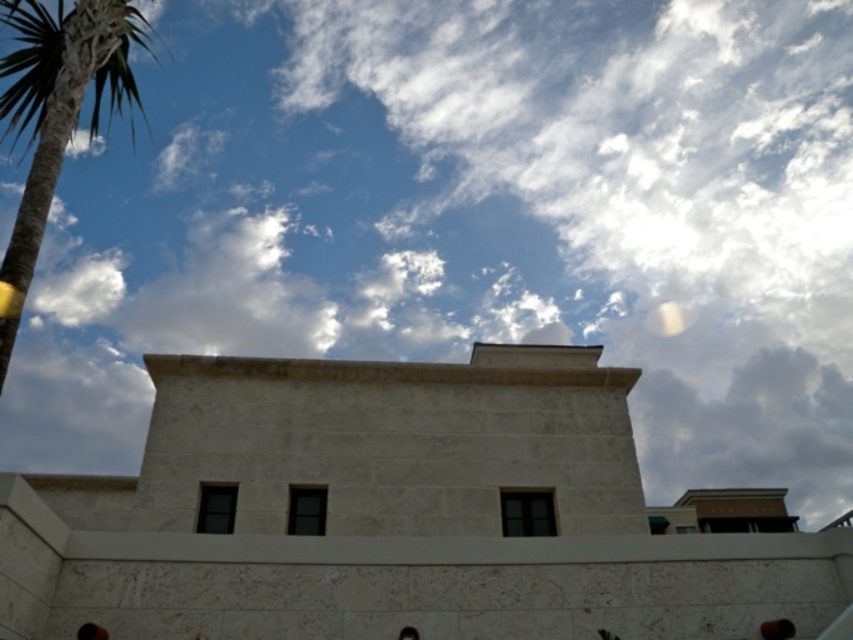
Question: Which of the following is the farthest from the observer?

Choices:
 (A) (775, 634)
 (B) (410, 627)

Answer: (A)

Question: Is green leafy palm at upper left to the right of black matte person at lower left from the viewer's perspective?

Choices:
 (A) no
 (B) yes

Answer: (A)

Question: Is green leafy palm at upper left thinner than black matte person at lower center?

Choices:
 (A) no
 (B) yes

Answer: (A)

Question: Which object is farther from the camera taking this photo?

Choices:
 (A) black matte person at lower left
 (B) black matte person at lower center

Answer: (B)

Question: Can you confirm if green leafy palm at upper left is positioned to the left of black matte person at lower left?

Choices:
 (A) no
 (B) yes

Answer: (B)

Question: Which of the following is the closest to the observer?

Choices:
 (A) (412, 634)
 (B) (762, 625)

Answer: (A)